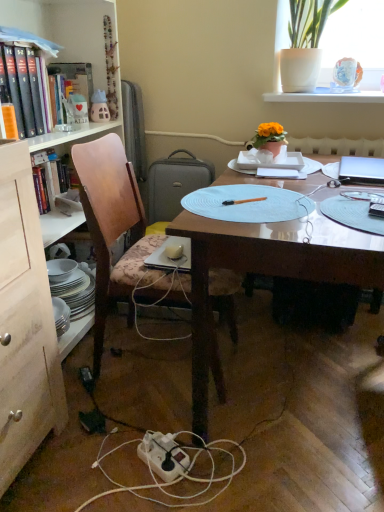
Find the location of `vacant space to the right of black plastic power plugs and sockets at lower left, the 2th power plugs and sockets from the front`. vacant space to the right of black plastic power plugs and sockets at lower left, the 2th power plugs and sockets from the front is located at coordinates click(130, 381).